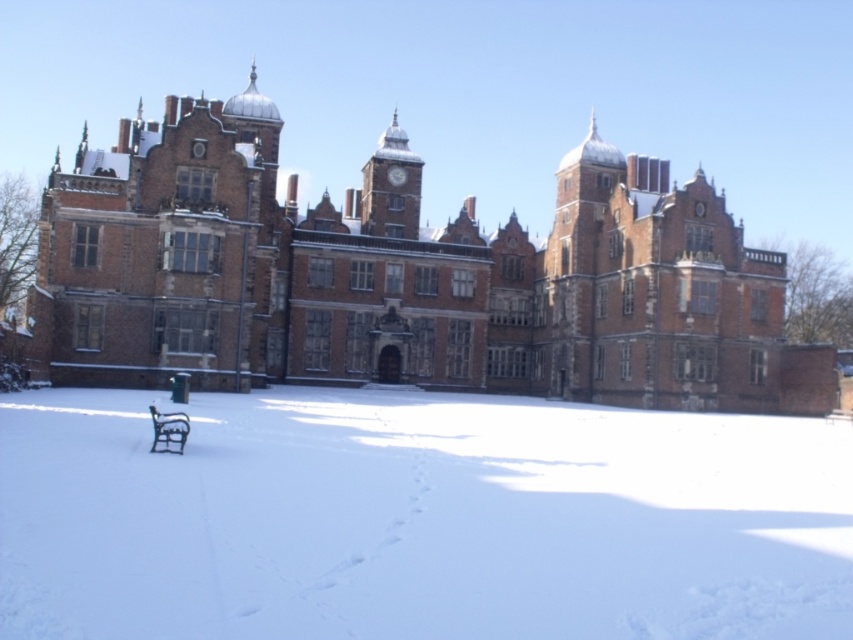
Question: Observing the image, what is the correct spatial positioning of white powdery snow at center in reference to brown brick castle at center?

Choices:
 (A) above
 (B) below

Answer: (B)

Question: Does white powdery snow at center come behind black wrought iron bench at lower left?

Choices:
 (A) yes
 (B) no

Answer: (B)

Question: Which object is positioned closest to the white powdery snow at center?

Choices:
 (A) brown brick castle at center
 (B) black wrought iron bench at lower left

Answer: (B)

Question: Does white powdery snow at center have a lesser width compared to black wrought iron bench at lower left?

Choices:
 (A) yes
 (B) no

Answer: (B)

Question: Among these points, which one is farthest from the camera?

Choices:
 (A) [x=35, y=307]
 (B) [x=163, y=420]
 (C) [x=695, y=440]

Answer: (A)

Question: Which point is farther from the camera taking this photo?

Choices:
 (A) (169, 448)
 (B) (161, 403)

Answer: (B)